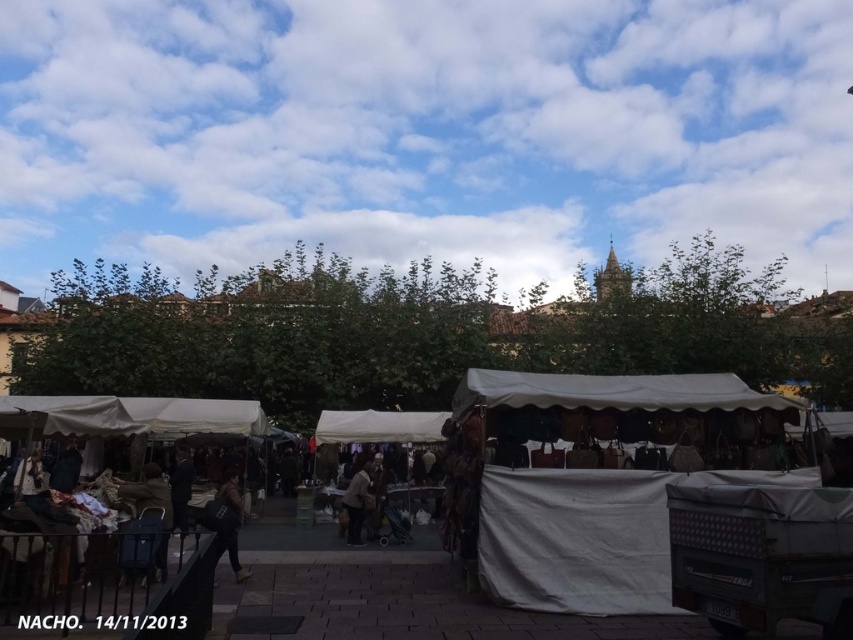
You are standing in the market and want to pick up the light brown fabric coat at center. Is the white fabric tent at center blocking your path to it?

The white fabric tent at center is closer to the viewer than the light brown fabric coat at center, so it is blocking your path to the light brown fabric coat at center.

You are a customer at the market and want to move from the white fabric tent at center to the white fabric market stall at center. Given that you have a 36 inch wide cart, will you be able to navigate between them without touching either structure?

The white fabric tent at center and white fabric market stall at center are 37.03 inches apart from each other. Since your cart is 36 inches wide, there is 1.03 inches of clearance on each side. However, this narrow space may make it difficult to maneuver without touching the structures, so proceed with caution.

You are standing at the market and want to take a photo that includes both the point at coordinates (772, 465) and the point at (548, 572). Which point should be placed closer to the front of the photo to ensure both are in focus?

Point (548, 572) should be placed closer to the front of the photo because it is closer to the camera than point (772, 465), so to keep both in focus, the closer point should be positioned nearer the front.